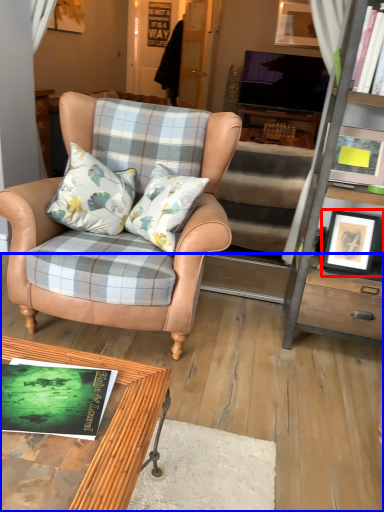
Question: Which object is closer to the camera taking this photo, picture frame (highlighted by a red box) or carpets (highlighted by a blue box)?

Choices:
 (A) picture frame
 (B) carpets

Answer: (B)